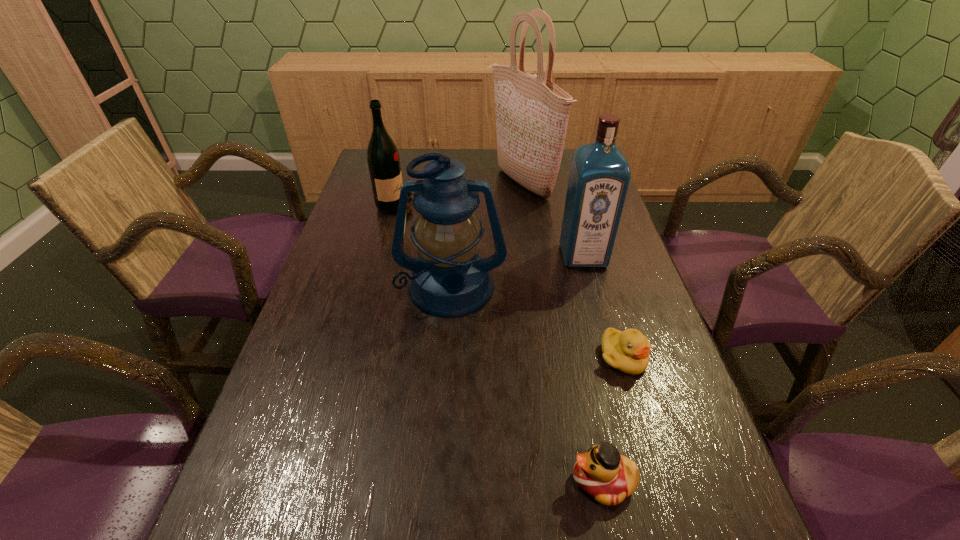
The image size is (960, 540). In order to click on shopping bag in this screenshot , I will do `click(532, 113)`.

Locate an element on the screen. liquor is located at coordinates (599, 177).

I want to click on lantern, so click(450, 279).

Locate an element on the screen. wine bottle is located at coordinates (383, 159).

Locate an element on the screen. This screenshot has height=540, width=960. the nearest object is located at coordinates [x=602, y=472].

Identify the location of the fifth farthest object. The width and height of the screenshot is (960, 540). (628, 351).

At what (x,y) coordinates should I click in order to perform the action: click on duckling. Please return your answer as a coordinate pair (x, y). Image resolution: width=960 pixels, height=540 pixels. Looking at the image, I should click on (628, 351).

What are the coordinates of `free location located 0.140m on the right of the tallest object` in the screenshot? It's located at (597, 184).

This screenshot has width=960, height=540. I want to click on vacant space located on the flat label side of the liquor, so click(x=590, y=283).

You are a GUI agent. You are given a task and a screenshot of the screen. Output one action in this format:
    pyautogui.click(x=<x>, y=<y>)
    Task: Click on the free spot located 0.100m on the face of the lantern
    The height and width of the screenshot is (540, 960).
    Given the screenshot: What is the action you would take?
    pyautogui.click(x=446, y=353)